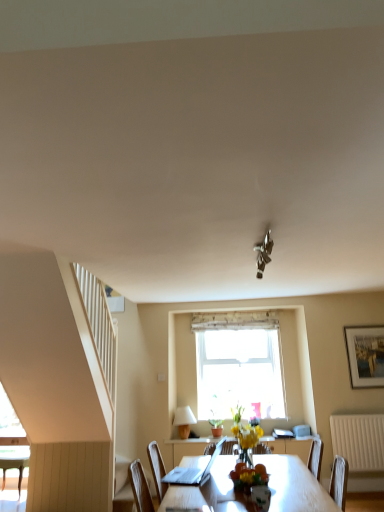
Question: Could silver metallic picture frame at upper right be considered to be inside white matte lampshade at lower center?

Choices:
 (A) yes
 (B) no

Answer: (B)

Question: Is white matte lampshade at lower center further to the viewer compared to silver metallic picture frame at upper right?

Choices:
 (A) no
 (B) yes

Answer: (A)

Question: Considering the relative sizes of white matte lampshade at lower center and silver metallic picture frame at upper right in the image provided, is white matte lampshade at lower center thinner than silver metallic picture frame at upper right?

Choices:
 (A) yes
 (B) no

Answer: (B)

Question: Can you confirm if white matte lampshade at lower center is smaller than silver metallic picture frame at upper right?

Choices:
 (A) yes
 (B) no

Answer: (B)

Question: From a real-world perspective, is white matte lampshade at lower center on silver metallic picture frame at upper right?

Choices:
 (A) no
 (B) yes

Answer: (A)

Question: Is metallic chrome light fixture at center bigger or smaller than wooden table at center?

Choices:
 (A) big
 (B) small

Answer: (B)

Question: Is metallic chrome light fixture at center inside the boundaries of wooden table at center, or outside?

Choices:
 (A) inside
 (B) outside

Answer: (B)

Question: From the image's perspective, is metallic chrome light fixture at center positioned above or below wooden table at center?

Choices:
 (A) above
 (B) below

Answer: (A)

Question: From a real-world perspective, relative to wooden table at center, is metallic chrome light fixture at center vertically above or below?

Choices:
 (A) above
 (B) below

Answer: (A)

Question: In terms of width, does wooden/textured curtain at upper center look wider or thinner when compared to silver metallic picture frame at upper right?

Choices:
 (A) thin
 (B) wide

Answer: (B)

Question: From the image's perspective, is wooden/textured curtain at upper center positioned above or below silver metallic picture frame at upper right?

Choices:
 (A) above
 (B) below

Answer: (A)

Question: Do you think wooden/textured curtain at upper center is within silver metallic picture frame at upper right, or outside of it?

Choices:
 (A) outside
 (B) inside

Answer: (A)

Question: In terms of height, does wooden/textured curtain at upper center look taller or shorter compared to silver metallic picture frame at upper right?

Choices:
 (A) short
 (B) tall

Answer: (A)

Question: Visually, is wooden/textured curtain at upper center positioned to the left or to the right of yellow matte vase at center?

Choices:
 (A) right
 (B) left

Answer: (A)

Question: Is wooden/textured curtain at upper center in front of or behind yellow matte vase at center in the image?

Choices:
 (A) front
 (B) behind

Answer: (B)